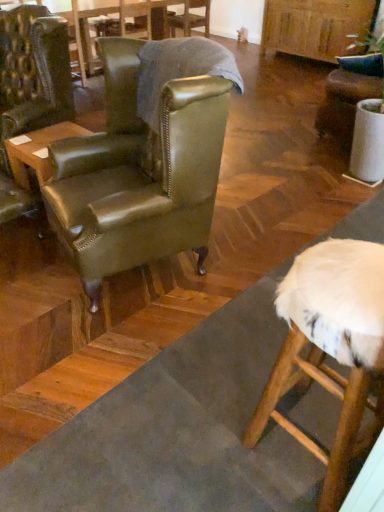
Question: From a real-world perspective, is leather wingback chair at center, the 1th chair viewed from the right, positioned under green leather table at upper left, the 2th table when ordered from bottom to top, based on gravity?

Choices:
 (A) no
 (B) yes

Answer: (A)

Question: Considering the relative positions of leather wingback chair at center, which is the fourth chair from left to right, and green leather table at upper left, the 2th table when ordered from bottom to top, in the image provided, is leather wingback chair at center, which is the fourth chair from left to right, to the left of green leather table at upper left, the 2th table when ordered from bottom to top, from the viewer's perspective?

Choices:
 (A) yes
 (B) no

Answer: (B)

Question: Is leather wingback chair at center, which is the fourth chair from left to right, not inside green leather table at upper left, the 1th table when ordered from back to front?

Choices:
 (A) yes
 (B) no

Answer: (A)

Question: Is leather wingback chair at center, marked as the 3th chair in a front-to-back arrangement, closer to the viewer compared to green leather table at upper left, the 2th table when ordered from bottom to top?

Choices:
 (A) yes
 (B) no

Answer: (A)

Question: From the image's perspective, is leather wingback chair at center, which is the 2th chair in back-to-front order, on green leather table at upper left, which appears as the 2th table when viewed from the front?

Choices:
 (A) no
 (B) yes

Answer: (A)

Question: Is leather wingback chair at upper center, acting as the 2th chair starting from the right, wider or thinner than leather wingback chair at center, marked as the 3th chair in a front-to-back arrangement?

Choices:
 (A) wide
 (B) thin

Answer: (B)

Question: Based on their positions, is leather wingback chair at upper center, which is the 4th chair from front to back, located to the left or right of leather wingback chair at center, marked as the 3th chair in a front-to-back arrangement?

Choices:
 (A) right
 (B) left

Answer: (B)

Question: From a real-world perspective, is leather wingback chair at upper center, which is the 4th chair from front to back, above or below leather wingback chair at center, which is the 2th chair in back-to-front order?

Choices:
 (A) above
 (B) below

Answer: (A)

Question: Considering the positions of point (x=205, y=8) and point (x=331, y=130), is point (x=205, y=8) closer or farther from the camera than point (x=331, y=130)?

Choices:
 (A) farther
 (B) closer

Answer: (A)

Question: In terms of size, does leather wingback chair at center, which is the 2th chair in back-to-front order, appear bigger or smaller than green leather wingback chair at center, the third chair when ordered from right to left?

Choices:
 (A) big
 (B) small

Answer: (B)

Question: Is point (342, 108) closer or farther from the camera than point (155, 132)?

Choices:
 (A) closer
 (B) farther

Answer: (B)

Question: From their relative heights in the image, would you say leather wingback chair at center, the 1th chair viewed from the right, is taller or shorter than green leather wingback chair at center, the 1th chair from the front?

Choices:
 (A) tall
 (B) short

Answer: (B)

Question: Looking at their shapes, would you say leather wingback chair at center, which is the 2th chair in back-to-front order, is wider or thinner than green leather wingback chair at center, the third chair when ordered from right to left?

Choices:
 (A) wide
 (B) thin

Answer: (B)

Question: Is wooden table at left, acting as the 2th table starting from the back, bigger or smaller than green leather table at upper left, the 2th table when ordered from bottom to top?

Choices:
 (A) big
 (B) small

Answer: (B)

Question: From the image's perspective, relative to green leather table at upper left, the 2th table when ordered from bottom to top, is wooden table at left, positioned as the second table in top-to-bottom order, above or below?

Choices:
 (A) below
 (B) above

Answer: (A)